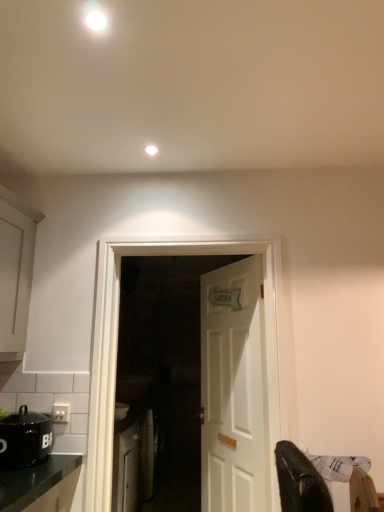
Question: Is white wooden door at center, arranged as the 1th door when viewed from the back, positioned beyond the bounds of white wooden door at center, arranged as the second door when viewed from the back?

Choices:
 (A) yes
 (B) no

Answer: (A)

Question: From a real-world perspective, is white wooden door at center, marked as the 2th door in a front-to-back arrangement, below white wooden door at center, the 1th door viewed from the front?

Choices:
 (A) no
 (B) yes

Answer: (B)

Question: Can you confirm if white wooden door at center, arranged as the 1th door when viewed from the back, is thinner than white wooden door at center, the 1th door viewed from the front?

Choices:
 (A) yes
 (B) no

Answer: (A)

Question: Is white wooden door at center, marked as the 2th door in a front-to-back arrangement, facing towards white wooden door at center, the 1th door viewed from the front?

Choices:
 (A) yes
 (B) no

Answer: (A)

Question: From a real-world perspective, is white wooden door at center, arranged as the 1th door when viewed from the back, on top of white wooden door at center, the 1th door viewed from the front?

Choices:
 (A) no
 (B) yes

Answer: (A)

Question: From the image's perspective, is white wooden door at center, arranged as the 1th door when viewed from the back, under white wooden door at center, the 1th door viewed from the front?

Choices:
 (A) yes
 (B) no

Answer: (A)

Question: From a real-world perspective, does white glossy cabinet at lower left, the 1th cabinetry when ordered from right to left, sit lower than black matte pot at lower left?

Choices:
 (A) no
 (B) yes

Answer: (B)

Question: Considering the relative sizes of white glossy cabinet at lower left, marked as the second cabinetry in a left-to-right arrangement, and black matte pot at lower left in the image provided, is white glossy cabinet at lower left, marked as the second cabinetry in a left-to-right arrangement, thinner than black matte pot at lower left?

Choices:
 (A) yes
 (B) no

Answer: (B)

Question: From the image's perspective, is white glossy cabinet at lower left, which is the 2th cabinetry in front-to-back order, on black matte pot at lower left?

Choices:
 (A) no
 (B) yes

Answer: (A)

Question: Considering the relative sizes of white glossy cabinet at lower left, the 2th cabinetry positioned from the top, and black matte pot at lower left in the image provided, is white glossy cabinet at lower left, the 2th cabinetry positioned from the top, shorter than black matte pot at lower left?

Choices:
 (A) no
 (B) yes

Answer: (A)

Question: From the image's perspective, is white glossy cabinet at lower left, arranged as the first cabinetry when ordered from the bottom, below black matte pot at lower left?

Choices:
 (A) no
 (B) yes

Answer: (B)

Question: From a real-world perspective, is white glossy cabinet at lower left, the 1th cabinetry when ordered from back to front, over black matte pot at lower left?

Choices:
 (A) no
 (B) yes

Answer: (A)

Question: Can you confirm if black matte pot at lower left is bigger than white matte cabinet at left, the 2th cabinetry from the back?

Choices:
 (A) yes
 (B) no

Answer: (B)